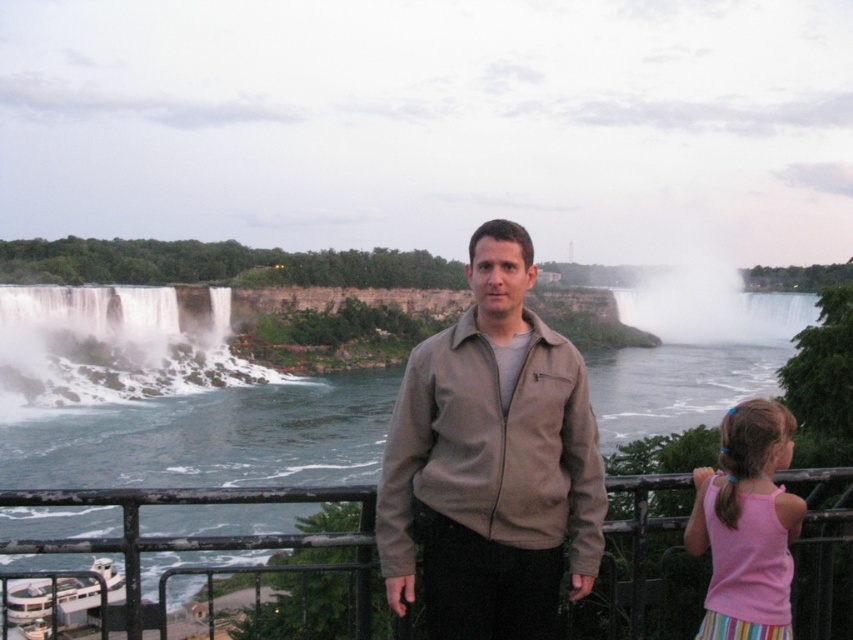
You are a tour guide leading a group at Niagara Falls. You notice a tourist who is standing near the black metal railing at center and wants to take a photo of the pink fabric hairband at lower right. Can they do so without moving from their current position?

The black metal railing at center is 17.42 feet away from the pink fabric hairband at lower right. Since the distance is over 15 feet, the tourist can likely take the photo without moving, as modern cameras can capture clear images from that distance.

You are a photographer planning to take a photo of the matte brown jacket at center. The camera you are using has a focal length of 50mm. If you want to ensure the jacket is centered in the frame, where should you position the camera relative to the jacket?

The matte brown jacket at center is already positioned at point (491,461), so to center it in the frame, the camera should be aligned directly facing the jacket at that coordinate point.